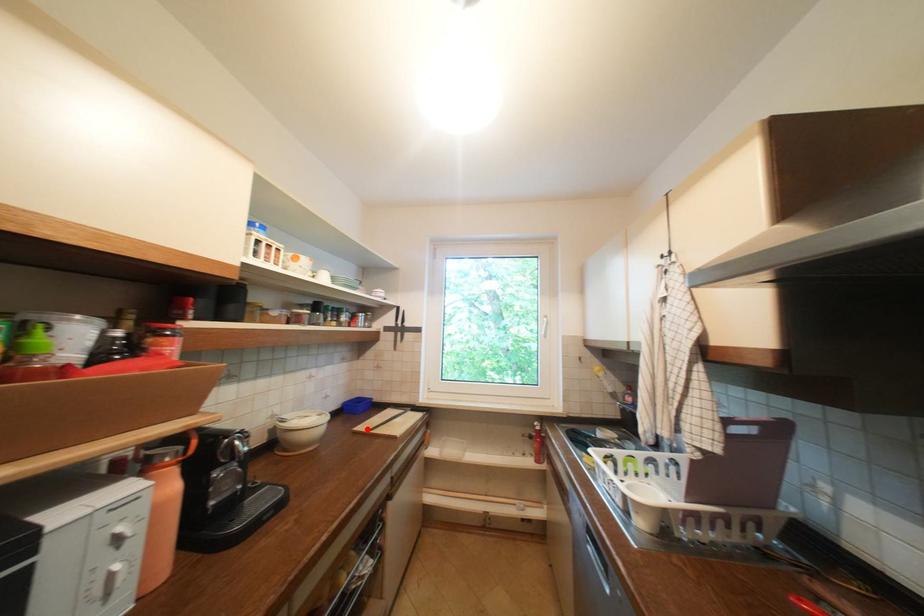
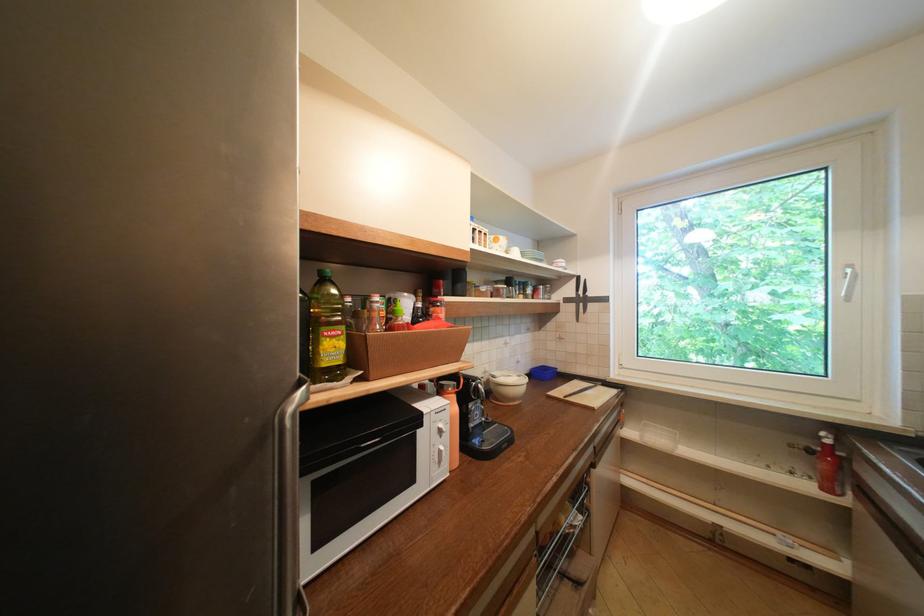
Find the pixel in the second image that matches the highlighted location in the first image.

(561, 394)